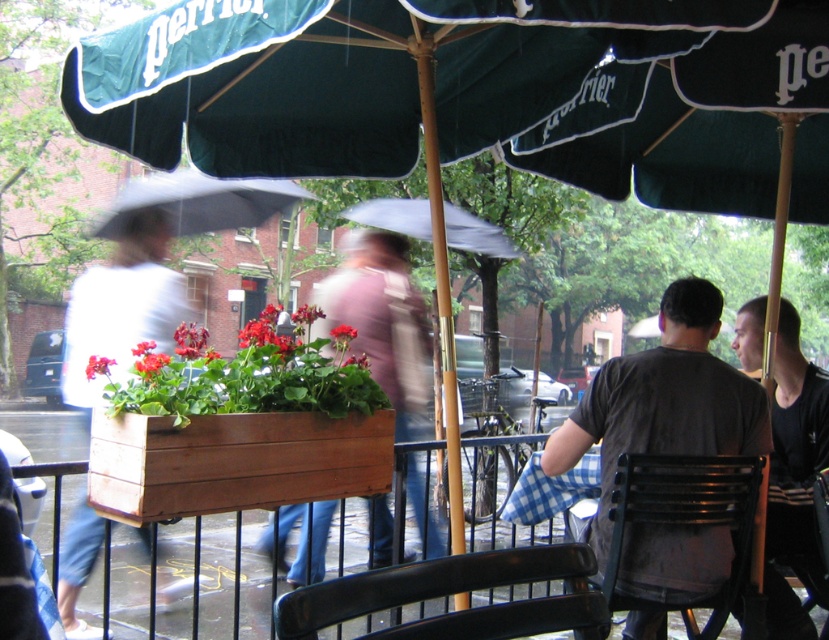
Question: Is white cotton shirt at left positioned in front of transparent plastic umbrella at upper center?

Choices:
 (A) no
 (B) yes

Answer: (B)

Question: Which of the following is the closest to the observer?

Choices:
 (A) black metal chair at lower right
 (B) dark gray shirt at right
 (C) white cotton shirt at left

Answer: (C)

Question: Estimate the real-world distances between objects in this image. Which object is farther from the black cotton shirt at right?

Choices:
 (A) dark gray shirt at right
 (B) white cotton shirt at left

Answer: (B)

Question: Which point is farther from the camera taking this photo?

Choices:
 (A) (447, 218)
 (B) (822, 484)
 (C) (798, 452)
 (D) (739, 483)

Answer: (A)

Question: Is dark gray shirt at right bigger than transparent plastic umbrella at upper center?

Choices:
 (A) yes
 (B) no

Answer: (B)

Question: Is wooden planter at center to the left of blue checkered tablecloth at lower center from the viewer's perspective?

Choices:
 (A) yes
 (B) no

Answer: (A)